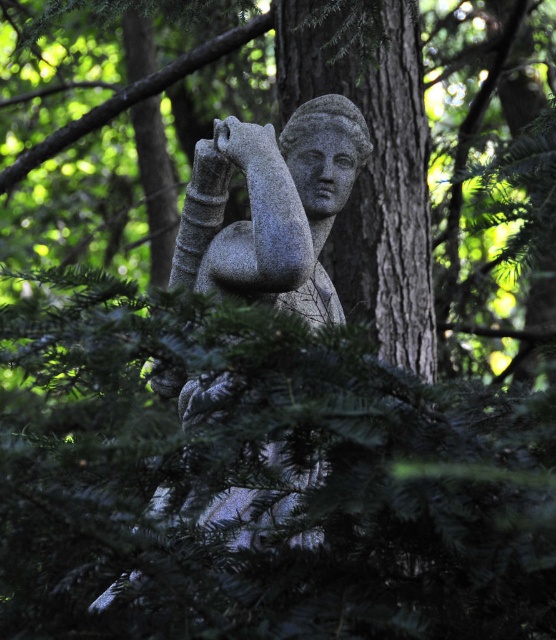
Question: Does gray stone tree trunk at center have a smaller size compared to granite statue at center?

Choices:
 (A) no
 (B) yes

Answer: (B)

Question: Which point is farther to the camera?

Choices:
 (A) gray stone tree trunk at center
 (B) granite statue at center

Answer: (A)

Question: Is gray stone tree trunk at center to the right of granite statue at center from the viewer's perspective?

Choices:
 (A) yes
 (B) no

Answer: (A)

Question: Can you confirm if gray stone tree trunk at center is thinner than granite statue at center?

Choices:
 (A) no
 (B) yes

Answer: (A)